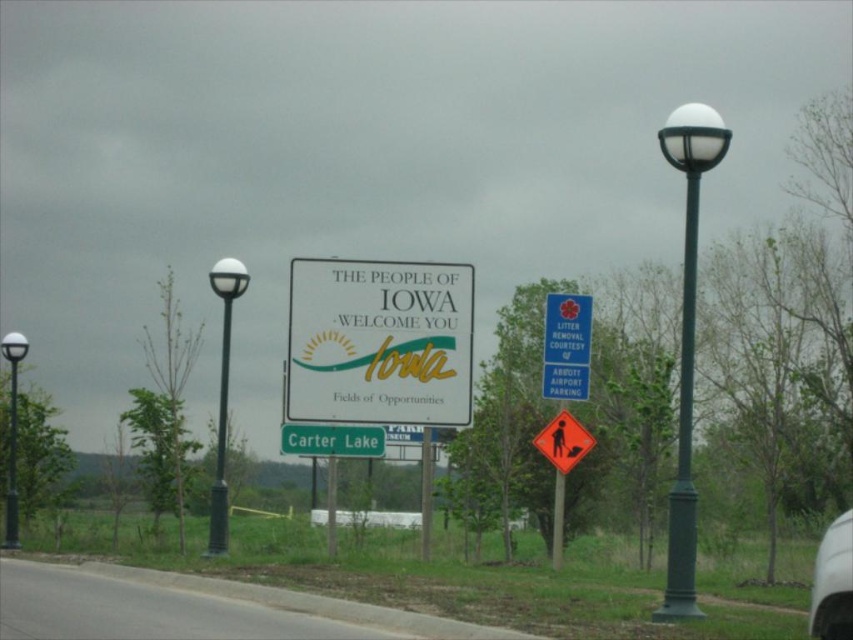
Question: Considering the real-world distances, which object is closest to the blue plastic sign at center right?

Choices:
 (A) orange reflective pedestrian crossing sign at center
 (B) green metallic pole at left
 (C) matte white sign at center

Answer: (A)

Question: Which point is closer to the camera?

Choices:
 (A) green metallic pole at left
 (B) brushed metal pole at center
 (C) blue plastic sign at center right

Answer: (C)

Question: Is matte black lamp post at left bigger than brushed metal pole at center?

Choices:
 (A) no
 (B) yes

Answer: (B)

Question: Is blue plastic sign at center right positioned in front of matte black lamp post at left?

Choices:
 (A) yes
 (B) no

Answer: (A)

Question: Which is nearer to the white glossy car at lower right?

Choices:
 (A) black metal pole at left
 (B) orange reflective pedestrian crossing sign at center
 (C) green painted metal pole at center
 (D) green matte lamp post at right

Answer: (D)

Question: Can you confirm if green matte lamp post at right is thinner than green matte sign at center?

Choices:
 (A) yes
 (B) no

Answer: (B)